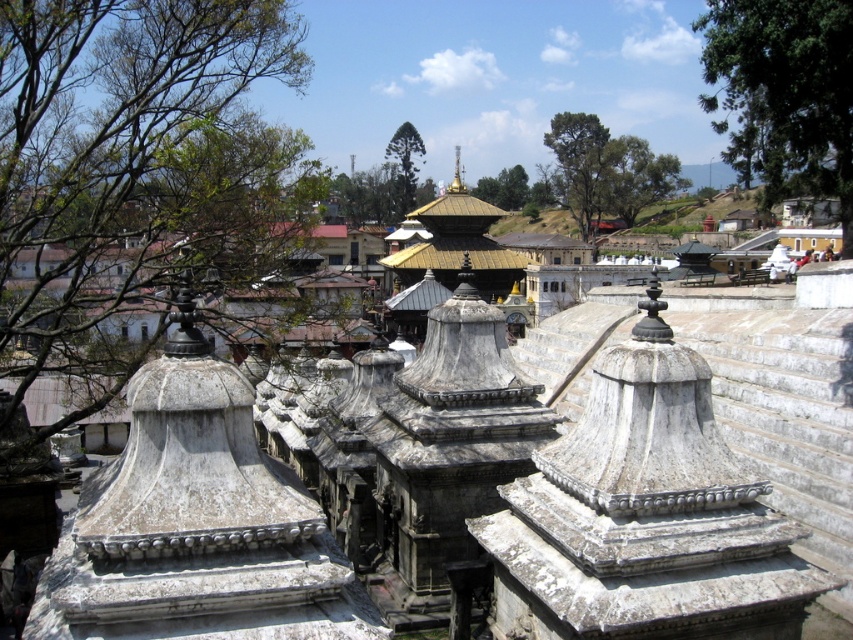
You are an architect visiting this temple complex and want to take a photo that includes both the green leafy tree at upper right and the green textured tree at center. Which tree should you position to your right side to include both in the frame?

To include both the green leafy tree at upper right and the green textured tree at center in your photo, position the green leafy tree at upper right to your right side since it is already on the right of the green textured tree at center.

You are standing in the temple complex and want to take a photo of the golden roofed building in the midground. To avoid the green leafy tree at upper left from blocking the view, where should you position yourself relative to the tree?

You should position yourself to the right of the green leafy tree at upper left to ensure it does not block the view of the golden roofed building in the midground.